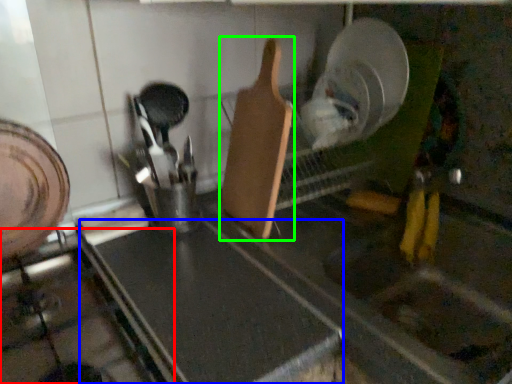
Question: Which is nearer to the gas stove (highlighted by a red box)? counter top (highlighted by a blue box) or spatula (highlighted by a green box).

Choices:
 (A) counter top
 (B) spatula

Answer: (A)